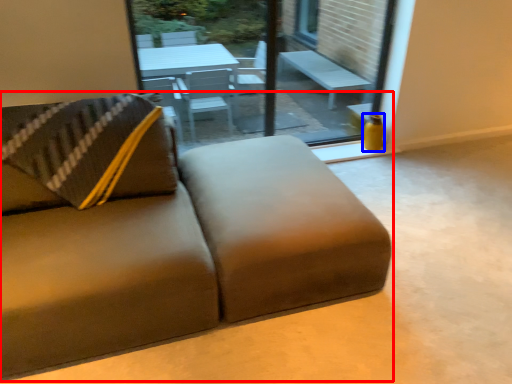
Question: Which object is further to the camera taking this photo, studio couch (highlighted by a red box) or vase (highlighted by a blue box)?

Choices:
 (A) studio couch
 (B) vase

Answer: (B)